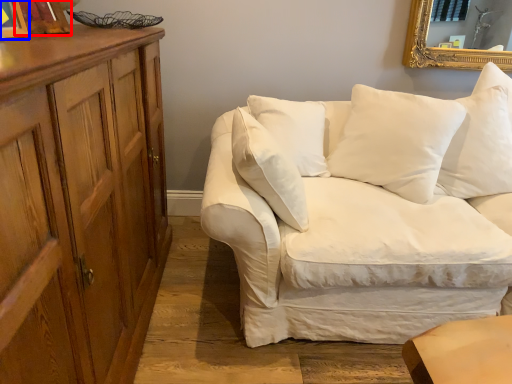
Question: Which point is closer to the camera, picture frame (highlighted by a red box) or picture frame (highlighted by a blue box)?

Choices:
 (A) picture frame
 (B) picture frame

Answer: (B)